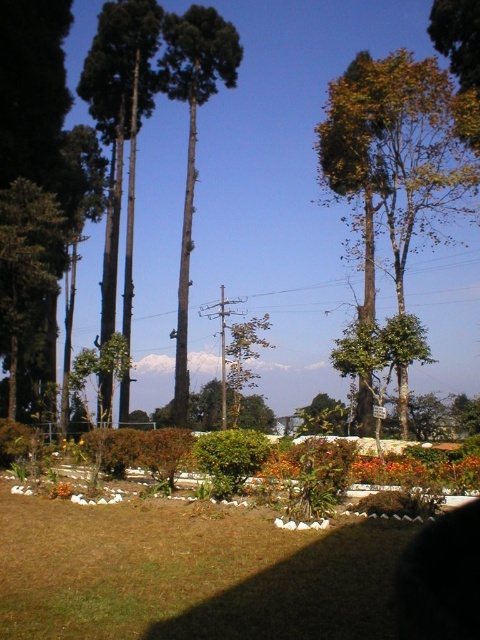
Question: Is green matte tree at center behind green leafy tree at center?

Choices:
 (A) yes
 (B) no

Answer: (B)

Question: Which point is farther to the camera?

Choices:
 (A) orange matte flowers at center
 (B) green leafy tree at center

Answer: (B)

Question: Based on their relative distances, which object is nearer to the orange matte flowers at center?

Choices:
 (A) green grass at lower center
 (B) green matte tree at center

Answer: (A)

Question: Based on their relative distances, which object is nearer to the green leafy tree at upper right?

Choices:
 (A) orange matte flower at lower left
 (B) orange matte flowers at center
 (C) green leafy tree at center
 (D) green matte tree at left

Answer: (C)

Question: Does green grass at lower center have a greater width compared to orange matte flowers at center?

Choices:
 (A) yes
 (B) no

Answer: (A)

Question: Observing the image, what is the correct spatial positioning of green leafy tree at center in reference to orange matte flower at lower left?

Choices:
 (A) right
 (B) left

Answer: (A)